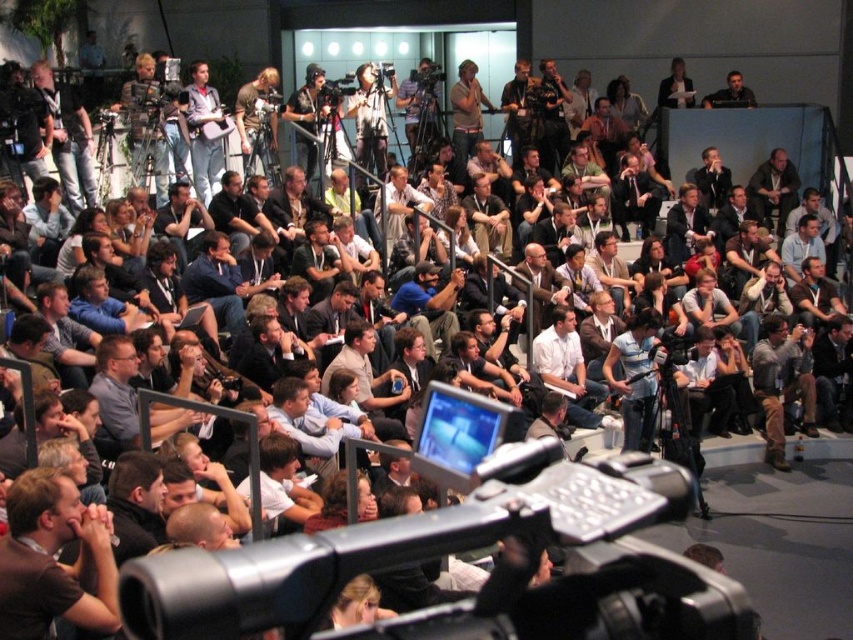
You are standing at the back of the conference room and want to walk to the stage. There are two points marked on the floor in front of you. Which point, point (x=683, y=604) or point (x=102, y=413), is closer to the stage?

Point (x=683, y=604) is closer to the stage because it is in front of point (x=102, y=413).

You are a photographer at the event and want to take a photo of the gray shirt at center and the light brown leather jacket at center. Which one will appear larger in the photo?

The gray shirt at center will appear larger in the photo because it is closer to the viewer than the light brown leather jacket at center.